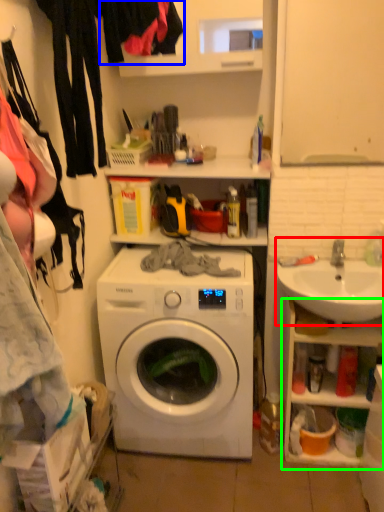
Question: Which is nearer to the sink (highlighted by a red box)? clothing (highlighted by a blue box) or cabinet (highlighted by a green box).

Choices:
 (A) clothing
 (B) cabinet

Answer: (B)